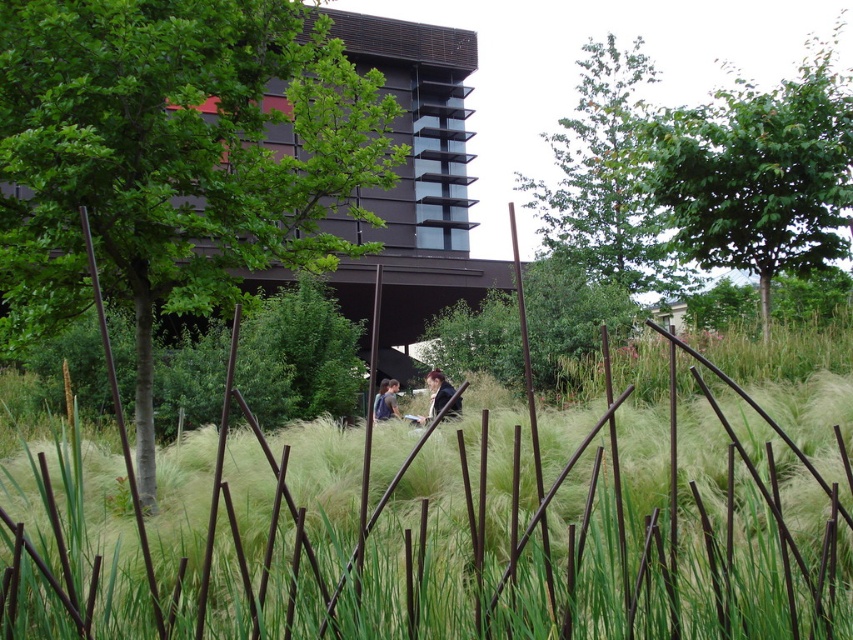
Question: In this image, where is green grass at center located relative to green leafy tree at center?

Choices:
 (A) below
 (B) above

Answer: (A)

Question: Does green leafy tree at upper right have a lesser width compared to green leafy tree at upper center?

Choices:
 (A) no
 (B) yes

Answer: (A)

Question: Which point is closer to the camera?

Choices:
 (A) (529, 621)
 (B) (32, 116)

Answer: (A)

Question: Estimate the real-world distances between objects in this image. Which object is closer to the dark brown leather jacket at center?

Choices:
 (A) green grass at center
 (B) blue denim jacket at center
 (C) green leafy tree at upper center

Answer: (B)

Question: Does green grass at center have a lesser width compared to green leafy tree at upper center?

Choices:
 (A) no
 (B) yes

Answer: (B)

Question: Among these points, which one is farthest from the camera?

Choices:
 (A) (386, 417)
 (B) (567, 177)

Answer: (B)